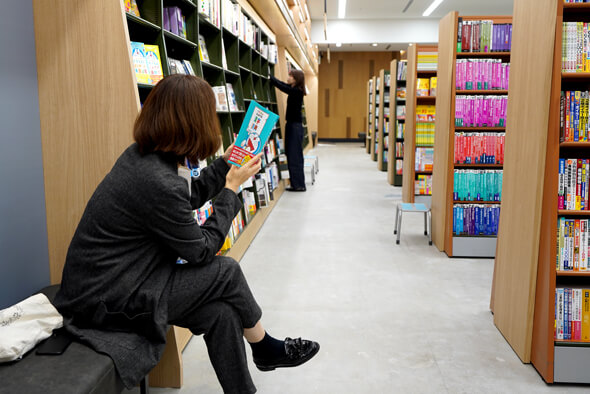
Locate an element on the screen. The width and height of the screenshot is (590, 394). gray painted wall is located at coordinates (32, 201).